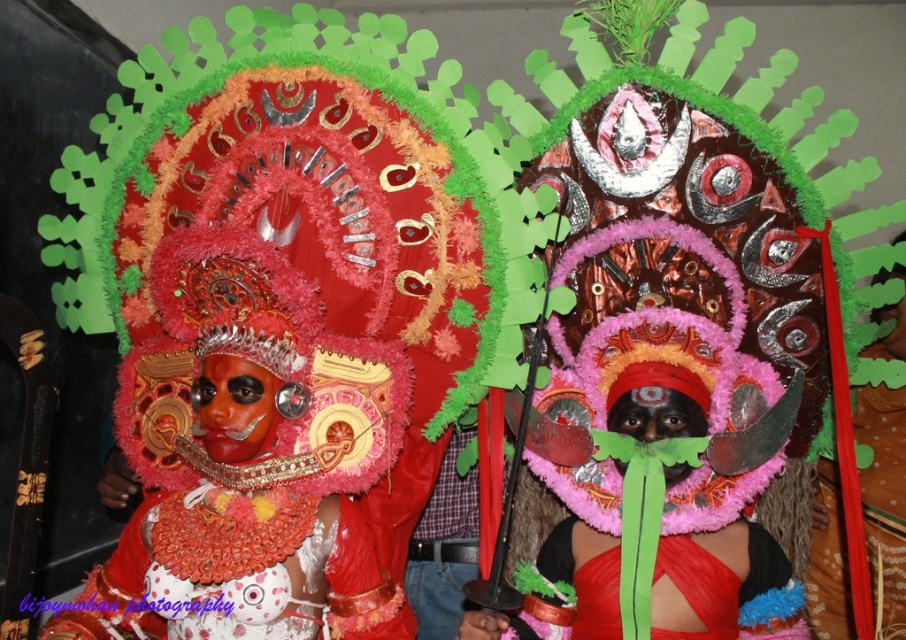
Question: Estimate the real-world distances between objects in this image. Which object is farther from the green feather headdress at center?

Choices:
 (A) shiny red fabric at center
 (B) matte red mask at center

Answer: (B)

Question: Among these objects, which one is nearest to the camera?

Choices:
 (A) shiny red fabric at center
 (B) matte red mask at center

Answer: (B)

Question: Does matte red mask at center come in front of green feather headdress at center?

Choices:
 (A) yes
 (B) no

Answer: (A)

Question: Which of the following is the farthest from the observer?

Choices:
 (A) shiny red fabric at center
 (B) green feather headdress at center
 (C) matte red mask at center

Answer: (A)

Question: Is matte red mask at center below green feather headdress at center?

Choices:
 (A) yes
 (B) no

Answer: (B)

Question: Is matte red mask at center above green feather headdress at center?

Choices:
 (A) yes
 (B) no

Answer: (A)